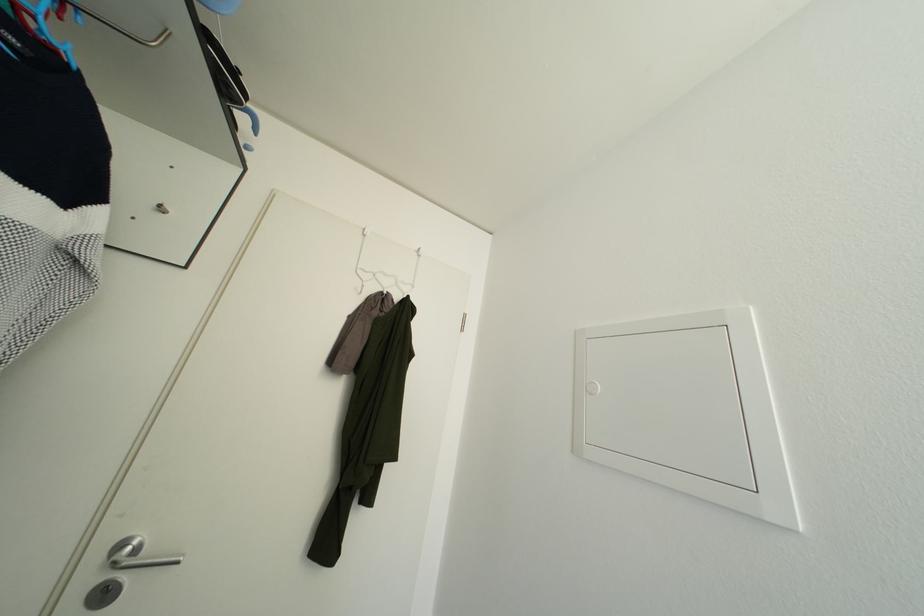
Image resolution: width=924 pixels, height=616 pixels. I want to click on silver door handle, so click(x=136, y=554).